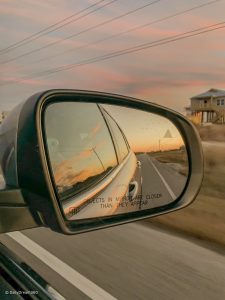
The height and width of the screenshot is (300, 225). Find the location of `door`. door is located at coordinates (117, 198).